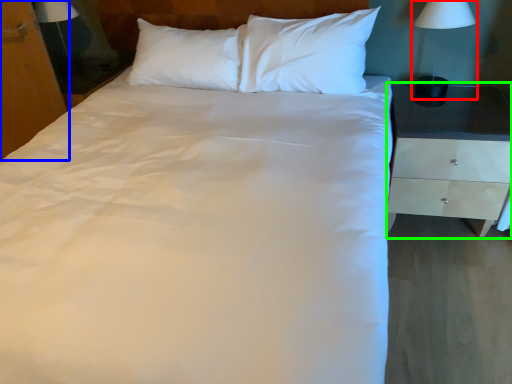
Question: Based on their relative distances, which object is farther from bedside lamp (highlighted by a red box)? Choose from dresser (highlighted by a blue box) and nightstand (highlighted by a green box).

Choices:
 (A) dresser
 (B) nightstand

Answer: (A)